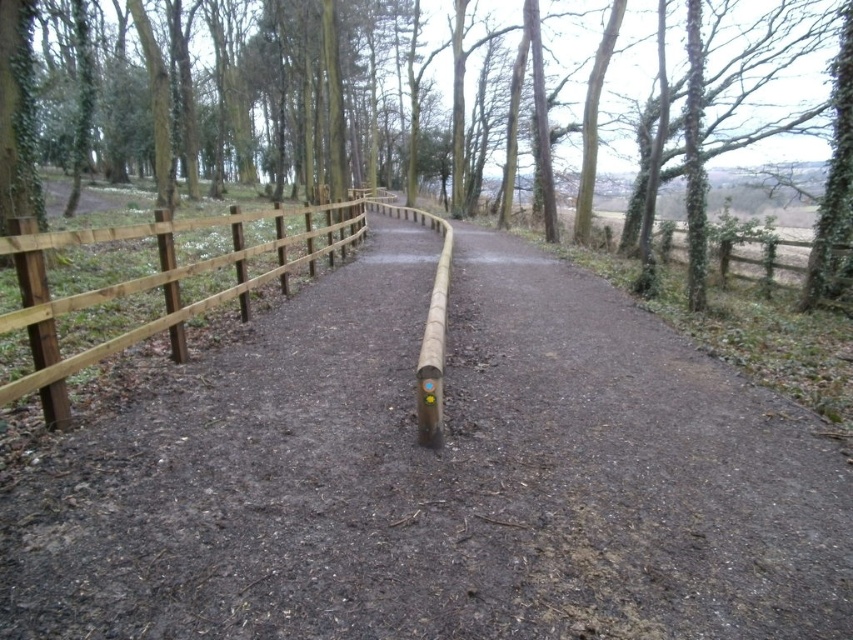
Does brown wooden path at center appear over brown wooden fence at center?

No, brown wooden path at center is not above brown wooden fence at center.

How much distance is there between brown wooden path at center and brown wooden fence at center?

brown wooden path at center and brown wooden fence at center are 43.78 feet apart.

Which is in front, point (579, 572) or point (85, 58)?

Point (579, 572) is in front.

Where is `brown wooden path at center`? brown wooden path at center is located at coordinates (440, 477).

Can you confirm if brown dirt path at center is bigger than natural wood fence at left?

Correct, brown dirt path at center is larger in size than natural wood fence at left.

Who is taller, brown dirt path at center or natural wood fence at left?

natural wood fence at left is taller.

Where is `brown dirt path at center`? brown dirt path at center is located at coordinates (627, 470).

This screenshot has width=853, height=640. Find the location of `brown dirt path at center`. brown dirt path at center is located at coordinates (627, 470).

Who is more distant from viewer, (193, 588) or (560, 577)?

The point (560, 577) is more distant.

At what (x,y) coordinates should I click in order to perform the action: click on brown wooden path at center. Please return your answer as a coordinate pair (x, y). The width and height of the screenshot is (853, 640). Looking at the image, I should click on (440, 477).